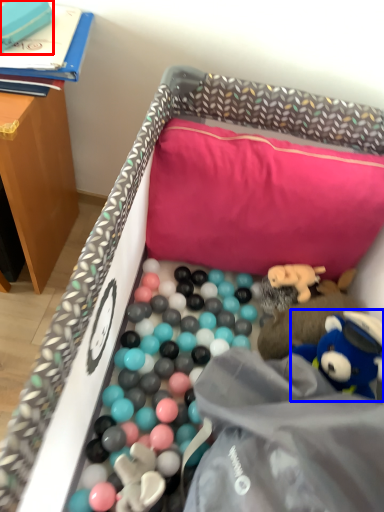
Question: Which object appears farthest to the camera in this image, toy (highlighted by a red box) or toy (highlighted by a blue box)?

Choices:
 (A) toy
 (B) toy

Answer: (A)